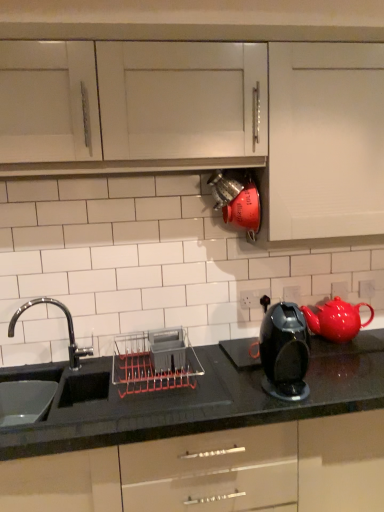
Question: Should I look upward or downward to see matte red kettle at center?

Choices:
 (A) up
 (B) down

Answer: (A)

Question: Is white matte cabinet at upper right in front of matte red kettle at center?

Choices:
 (A) no
 (B) yes

Answer: (B)

Question: Considering the relative sizes of white matte cabinet at upper right and matte red kettle at center in the image provided, is white matte cabinet at upper right thinner than matte red kettle at center?

Choices:
 (A) no
 (B) yes

Answer: (A)

Question: Is white matte cabinet at upper right to the left of matte red kettle at center from the viewer's perspective?

Choices:
 (A) no
 (B) yes

Answer: (A)

Question: From the image's perspective, is white matte cabinet at upper right over matte red kettle at center?

Choices:
 (A) no
 (B) yes

Answer: (B)

Question: From the image's perspective, would you say white matte cabinet at upper right is shown under matte red kettle at center?

Choices:
 (A) yes
 (B) no

Answer: (B)

Question: Can you confirm if white matte cabinet at upper right is smaller than matte red kettle at center?

Choices:
 (A) no
 (B) yes

Answer: (A)

Question: Can you confirm if matte red kettle at center is shorter than gray plastic dish rack at center?

Choices:
 (A) yes
 (B) no

Answer: (B)

Question: Is matte red kettle at center closer to camera compared to gray plastic dish rack at center?

Choices:
 (A) yes
 (B) no

Answer: (B)

Question: Could you tell me if matte red kettle at center is facing gray plastic dish rack at center?

Choices:
 (A) no
 (B) yes

Answer: (A)

Question: Is gray plastic dish rack at center located within matte red kettle at center?

Choices:
 (A) yes
 (B) no

Answer: (B)

Question: Is gray plastic dish rack at center at the back of matte red kettle at center?

Choices:
 (A) no
 (B) yes

Answer: (A)

Question: Does matte red kettle at center lie behind gray plastic dish rack at center?

Choices:
 (A) no
 (B) yes

Answer: (B)

Question: From the image's perspective, is red glossy teapot at right below white matte cabinet at upper right?

Choices:
 (A) yes
 (B) no

Answer: (A)